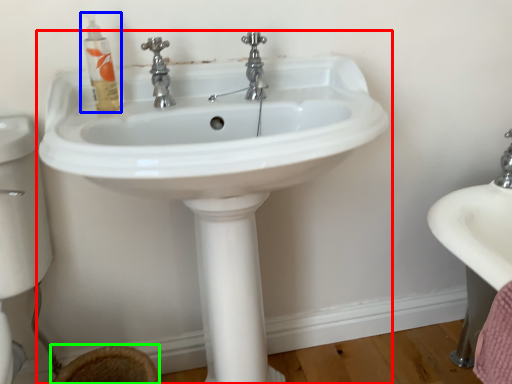
Question: Which is nearer to the sink (highlighted by a red box)? mouthwash (highlighted by a blue box) or toilet bowl (highlighted by a green box).

Choices:
 (A) mouthwash
 (B) toilet bowl

Answer: (A)